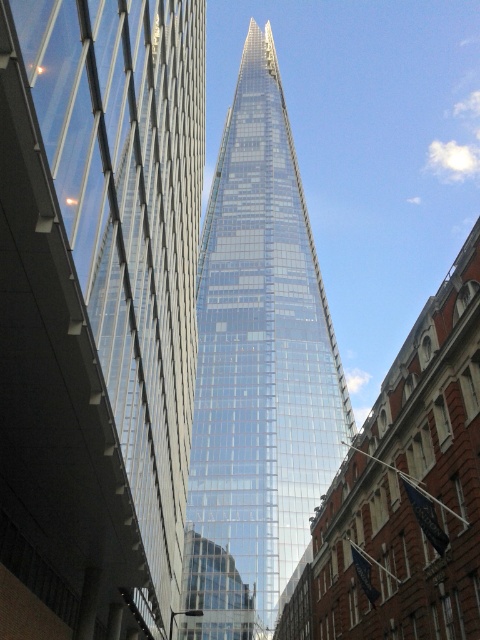
You are a photographer standing at the base of the transparent glass skyscraper at center and the transparent glass tower at center. You want to capture a photo that includes both buildings in the frame. Which building should you position closer to the camera to ensure both are fully visible?

The transparent glass skyscraper at center is smaller in size compared to the transparent glass tower at center. To include both in the frame, position the smaller skyscraper closer to the camera so that its size in the photo balances with the larger tower in the background.

You are an architect analyzing the skyline of London. You observe the transparent glass skyscraper at center and the transparent glass tower at center in the image. Which of these two structures has a greater height?

The transparent glass tower at center is taller than the transparent glass skyscraper at center.